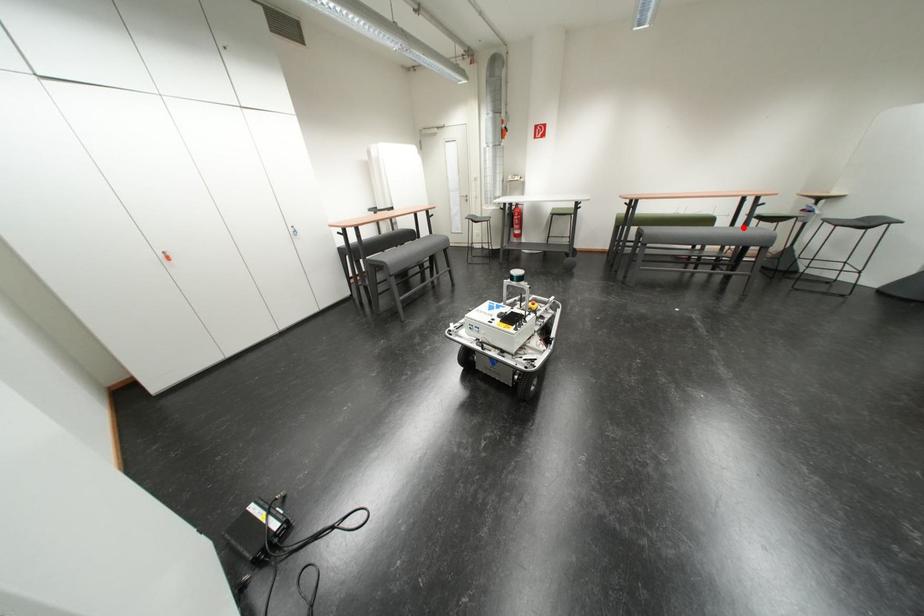
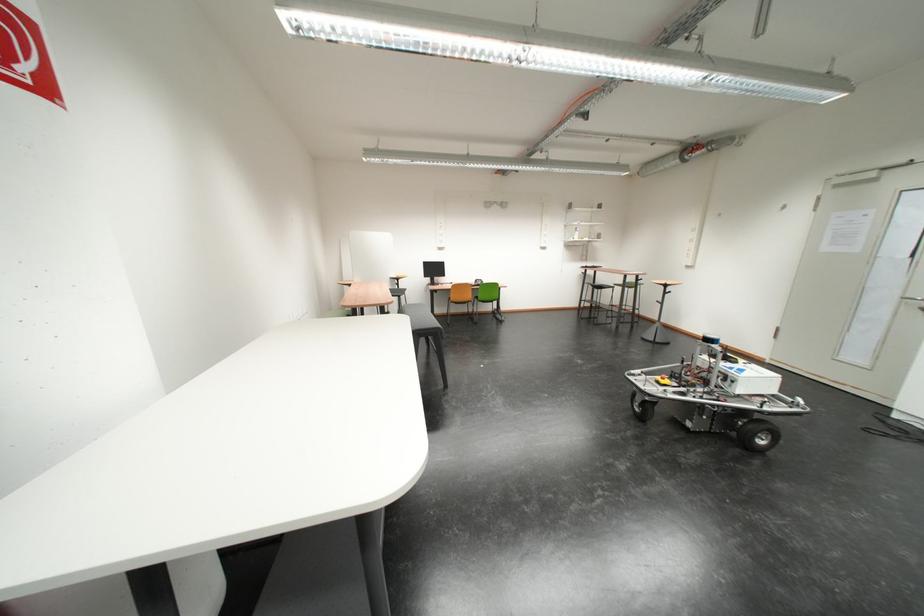
Question: I am providing you with two images of the same scene from different viewpoints. A red point is marked on the first image. At the location where the point appears in image 1, is it still visible in image 2?

Choices:
 (A) Yes
 (B) No

Answer: (B)